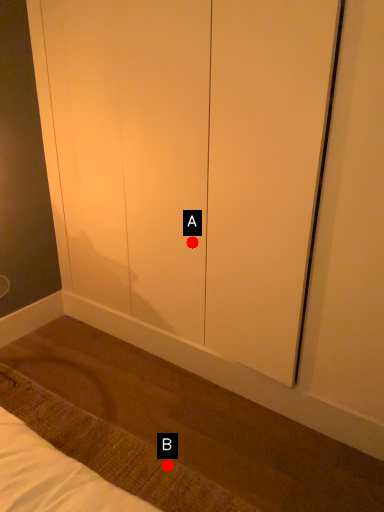
Question: Two points are circled on the image, labeled by A and B beside each circle. Among these points, which one is farthest from the camera?

Choices:
 (A) A is further
 (B) B is further

Answer: (A)